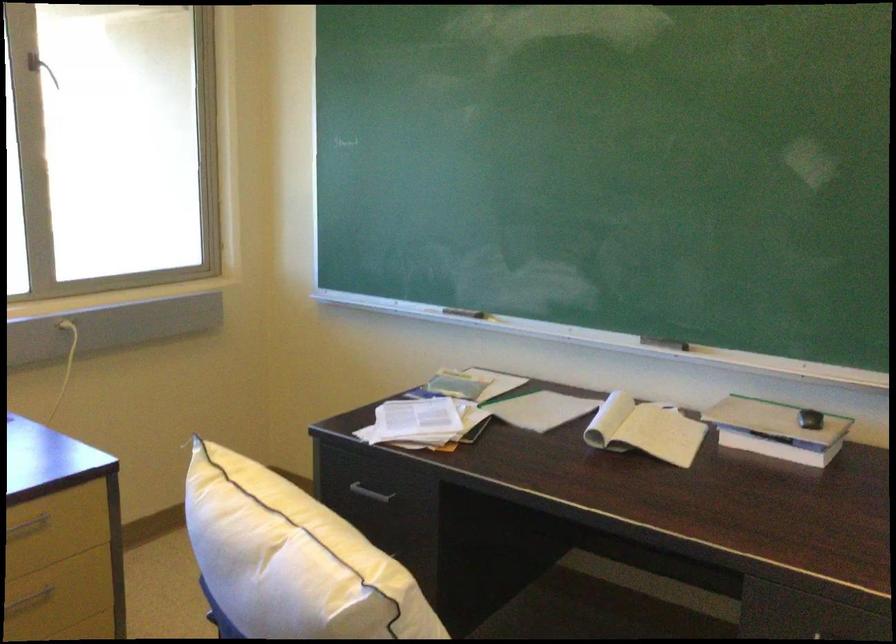
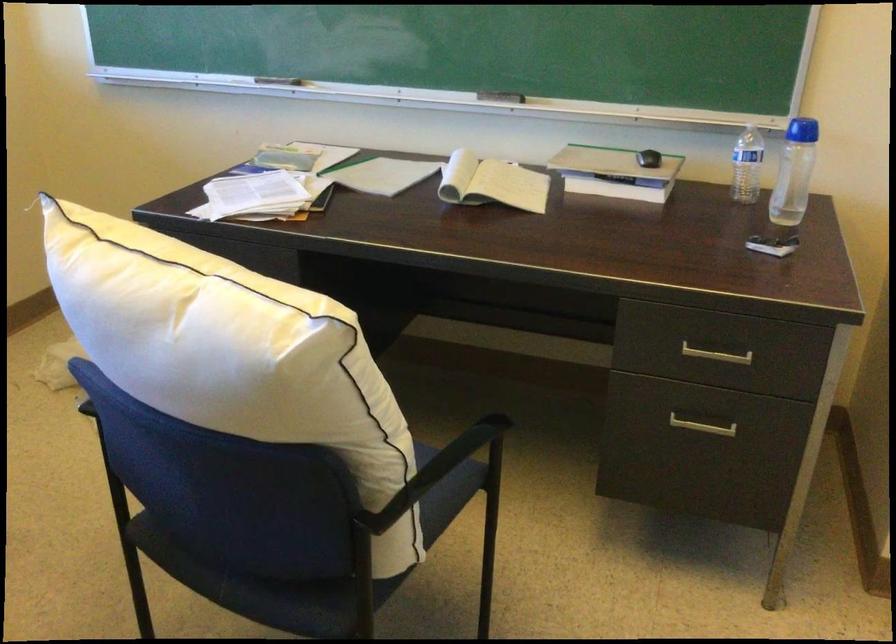
Where in the second image is the point corresponding to [771,426] from the first image?

(615, 173)